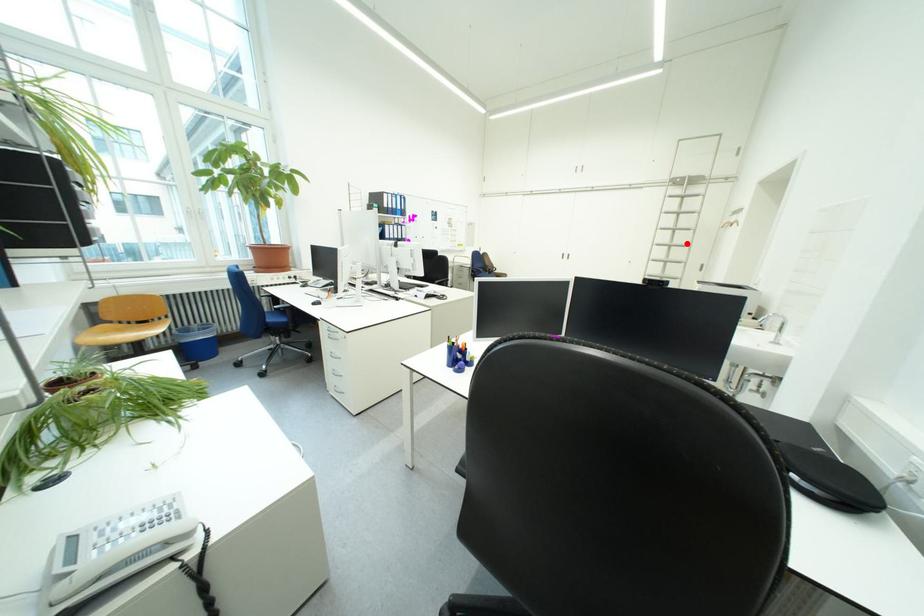
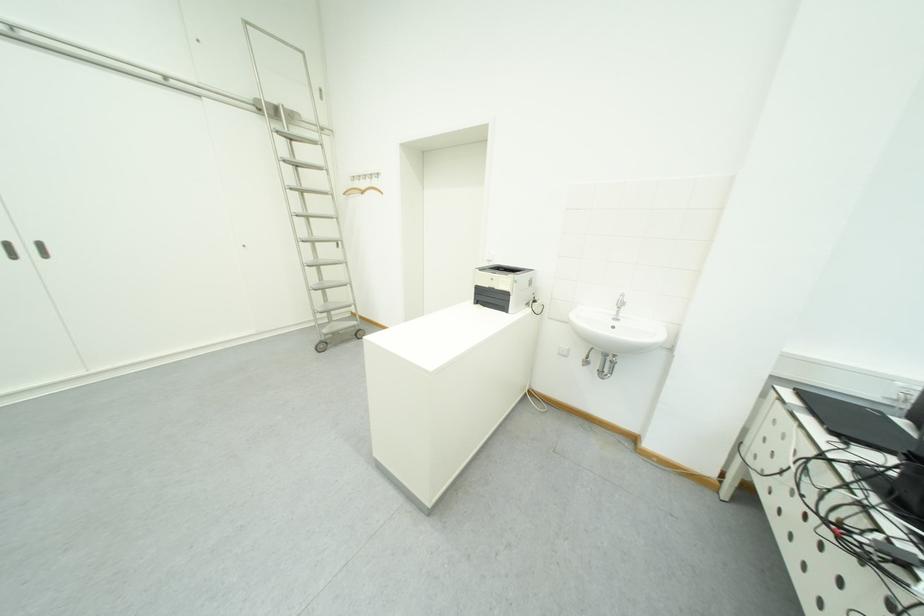
Where in the second image is the point corresponding to the highlighted location from the first image?

(322, 213)